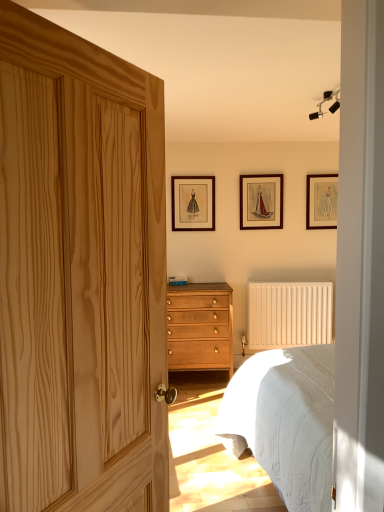
Image resolution: width=384 pixels, height=512 pixels. Find the location of `free space above light brown wood chest of drawers at center (from a real-world perspective)`. free space above light brown wood chest of drawers at center (from a real-world perspective) is located at coordinates (201, 285).